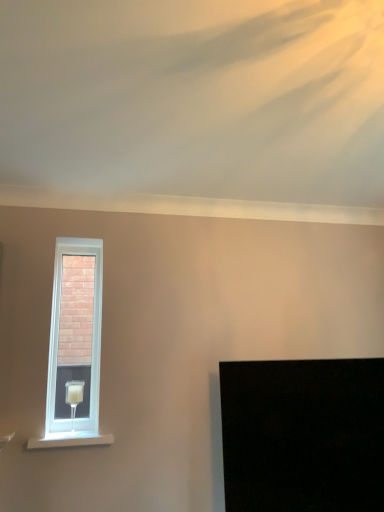
Identify the location of white painted wood at lower left. This screenshot has height=512, width=384. (70, 440).

The height and width of the screenshot is (512, 384). Describe the element at coordinates (74, 397) in the screenshot. I see `translucent glass table lamp at left` at that location.

This screenshot has width=384, height=512. Describe the element at coordinates (303, 435) in the screenshot. I see `black glossy screen at lower right` at that location.

The width and height of the screenshot is (384, 512). Find the location of `white painted wood at lower left`. white painted wood at lower left is located at coordinates (70, 440).

Can you confirm if translucent glass table lamp at left is bigger than white plastic window at upper left?

No.

Considering the sizes of translucent glass table lamp at left and white plastic window at upper left in the image, is translucent glass table lamp at left taller or shorter than white plastic window at upper left?

translucent glass table lamp at left is shorter than white plastic window at upper left.

Is translucent glass table lamp at left outside of white plastic window at upper left?

No, translucent glass table lamp at left is inside white plastic window at upper left's boundary.

Is the surface of translucent glass table lamp at left in direct contact with white plastic window at upper left?

translucent glass table lamp at left and white plastic window at upper left are clearly separated.

Is black glossy screen at lower right facing towards translucent glass table lamp at left?

No, black glossy screen at lower right is not oriented towards translucent glass table lamp at left.

In the image, is black glossy screen at lower right positioned in front of or behind translucent glass table lamp at left?

black glossy screen at lower right is in front of translucent glass table lamp at left.

Consider the image. Measure the distance from black glossy screen at lower right to translucent glass table lamp at left.

black glossy screen at lower right and translucent glass table lamp at left are 2.29 meters apart.

How different are the orientations of black glossy screen at lower right and translucent glass table lamp at left in degrees?

39.1 degrees.

Is the depth of white plastic window at upper left greater than that of white painted wood at lower left?

Yes.

From a real-world perspective, is white plastic window at upper left located higher than white painted wood at lower left?

Yes, from a real-world perspective, white plastic window at upper left is over white painted wood at lower left

Could you tell me if translucent glass table lamp at left is facing white painted wood at lower left?

No, translucent glass table lamp at left is not aimed at white painted wood at lower left.

Does translucent glass table lamp at left have a smaller size compared to white painted wood at lower left?

No.

Looking at this image, is translucent glass table lamp at left taller than white painted wood at lower left?

Yes.

From a real-world perspective, which object rests below the other?

white painted wood at lower left, from a real-world perspective.

Considering the positions of objects black glossy screen at lower right and white painted wood at lower left in the image provided, who is in front, black glossy screen at lower right or white painted wood at lower left?

black glossy screen at lower right.

From the image's perspective, is black glossy screen at lower right on top of white painted wood at lower left?

Yes, from the image's perspective, black glossy screen at lower right is on top of white painted wood at lower left.

From a real-world perspective, is black glossy screen at lower right below white painted wood at lower left?

No, from a real-world perspective, black glossy screen at lower right is not under white painted wood at lower left.

Locate an element on the screen. Image resolution: width=384 pixels, height=512 pixels. computer screen that appears in front of the white painted wood at lower left is located at coordinates (303, 435).

From the image's perspective, would you say white plastic window at upper left is shown under translucent glass table lamp at left?

Incorrect, from the image's perspective, white plastic window at upper left is higher than translucent glass table lamp at left.

Could you tell me if white plastic window at upper left is turned towards translucent glass table lamp at left?

Yes, white plastic window at upper left is oriented towards translucent glass table lamp at left.

From a real-world perspective, which is physically above, white plastic window at upper left or translucent glass table lamp at left?

white plastic window at upper left, from a real-world perspective.

From the picture: Looking at the image, does white plastic window at upper left seem bigger or smaller compared to translucent glass table lamp at left?

white plastic window at upper left is bigger than translucent glass table lamp at left.

Between white painted wood at lower left and translucent glass table lamp at left, which one appears on the right side from the viewer's perspective?

From the viewer's perspective, white painted wood at lower left appears more on the right side.

Who is smaller, white painted wood at lower left or translucent glass table lamp at left?

With smaller size is white painted wood at lower left.

Considering the relative positions of white painted wood at lower left and translucent glass table lamp at left in the image provided, is white painted wood at lower left behind translucent glass table lamp at left?

No.

Is white painted wood at lower left not within translucent glass table lamp at left?

white painted wood at lower left lies outside translucent glass table lamp at left's area.

Where is `table lamp on the right of white plastic window at upper left`? table lamp on the right of white plastic window at upper left is located at coordinates (74, 397).

Locate an element on the screen. The image size is (384, 512). table lamp lying behind the black glossy screen at lower right is located at coordinates (74, 397).

Looking at the image, which one is located closer to black glossy screen at lower right, white plastic window at upper left or translucent glass table lamp at left?

white plastic window at upper left is closer to black glossy screen at lower right.

Based on their spatial positions, is white painted wood at lower left or translucent glass table lamp at left further from black glossy screen at lower right?

Based on the image, translucent glass table lamp at left appears to be further to black glossy screen at lower right.

When comparing their distances from black glossy screen at lower right, does white painted wood at lower left or white plastic window at upper left seem closer?

white painted wood at lower left is closer to black glossy screen at lower right.

From the image, which object appears to be nearer to white painted wood at lower left, translucent glass table lamp at left or black glossy screen at lower right?

Based on the image, black glossy screen at lower right appears to be nearer to white painted wood at lower left.

From the image, which object appears to be nearer to translucent glass table lamp at left, white plastic window at upper left or black glossy screen at lower right?

Among the two, white plastic window at upper left is located nearer to translucent glass table lamp at left.

Considering their positions, is translucent glass table lamp at left positioned further to white plastic window at upper left than black glossy screen at lower right?

black glossy screen at lower right lies further to white plastic window at upper left than the other object.

Considering their positions, is translucent glass table lamp at left positioned closer to white plastic window at upper left than white painted wood at lower left?

Based on the image, translucent glass table lamp at left appears to be nearer to white plastic window at upper left.

When comparing their distances from black glossy screen at lower right, does white plastic window at upper left or white painted wood at lower left seem further?

white plastic window at upper left is positioned further to the anchor black glossy screen at lower right.

This screenshot has height=512, width=384. In order to click on window sill between translucent glass table lamp at left and black glossy screen at lower right in the horizontal direction in this screenshot , I will do `click(70, 440)`.

Locate an element on the screen. Image resolution: width=384 pixels, height=512 pixels. table lamp between white plastic window at upper left and white painted wood at lower left vertically is located at coordinates (74, 397).

In order to click on window sill situated between white plastic window at upper left and black glossy screen at lower right from left to right in this screenshot , I will do `click(70, 440)`.

This screenshot has height=512, width=384. I want to click on table lamp situated between white plastic window at upper left and black glossy screen at lower right from left to right, so click(x=74, y=397).